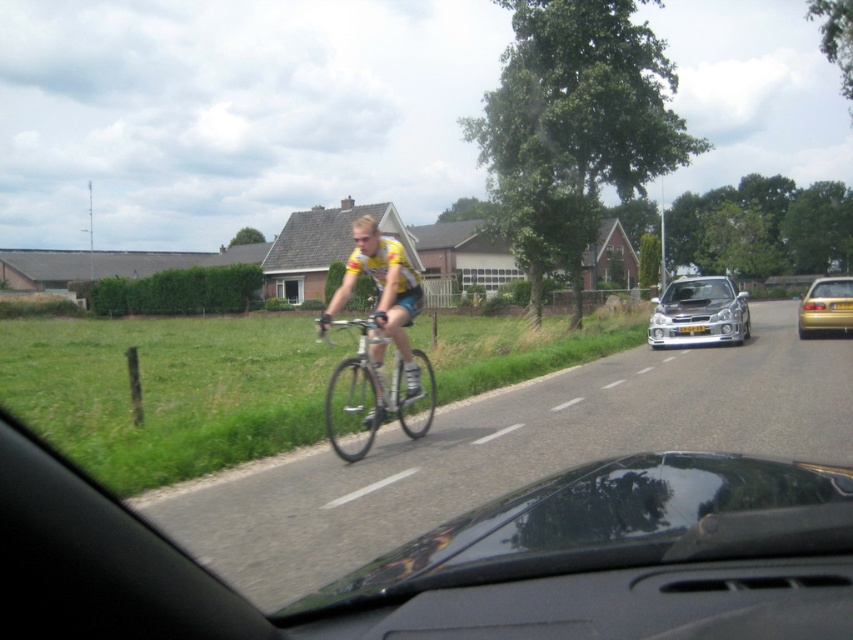
Describe the element at coordinates (698, 314) in the screenshot. I see `silver metallic car at center-right` at that location.

Which is in front, point (730, 292) or point (814, 314)?

Point (814, 314)

Find the location of a particular element. The image size is (853, 640). silver metallic car at center-right is located at coordinates (698, 314).

Looking at this image, between silver metallic bicycle at center and gold metallic car at right, which one is positioned higher?

Positioned higher is gold metallic car at right.

What do you see at coordinates (374, 388) in the screenshot?
I see `silver metallic bicycle at center` at bounding box center [374, 388].

Is point (366, 442) closer to camera compared to point (828, 288)?

Yes, point (366, 442) is closer to viewer.

Find the location of `silver metallic bicycle at center`. silver metallic bicycle at center is located at coordinates (374, 388).

Which is more to the right, silver metallic bicycle at center or silver metallic car at center-right?

From the viewer's perspective, silver metallic car at center-right appears more on the right side.

Does silver metallic bicycle at center have a lesser height compared to silver metallic car at center-right?

Yes, silver metallic bicycle at center is shorter than silver metallic car at center-right.

The height and width of the screenshot is (640, 853). What do you see at coordinates (374, 388) in the screenshot? I see `silver metallic bicycle at center` at bounding box center [374, 388].

The height and width of the screenshot is (640, 853). Identify the location of silver metallic bicycle at center. (374, 388).